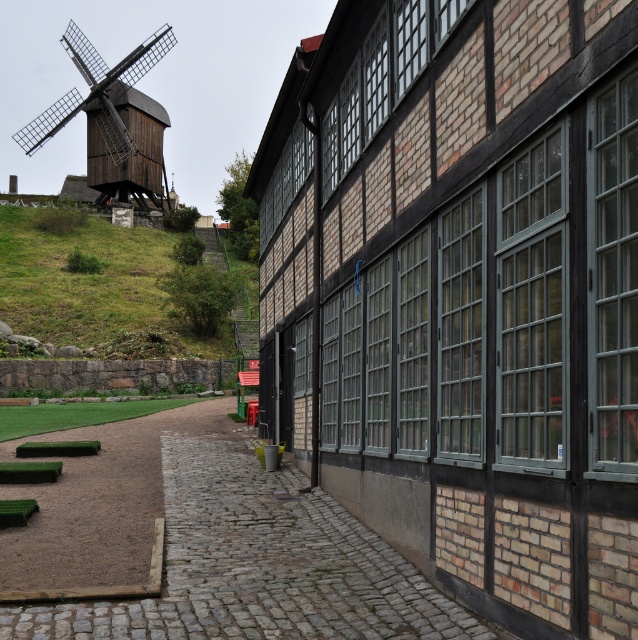
Does point (329, 541) lie behind point (15, 220)?

No.

Does cobblestone path at lower left have a lesser width compared to green grass at lower left?

Yes, cobblestone path at lower left is thinner than green grass at lower left.

This screenshot has height=640, width=638. What do you see at coordinates (216, 548) in the screenshot? I see `cobblestone path at lower left` at bounding box center [216, 548].

The image size is (638, 640). Find the location of `cobblestone path at lower left`. cobblestone path at lower left is located at coordinates (216, 548).

Is cobblestone path at lower left bigger than wooden windmill at left?

No, cobblestone path at lower left is not bigger than wooden windmill at left.

Is cobblestone path at lower left shorter than wooden windmill at left?

Yes, cobblestone path at lower left is shorter than wooden windmill at left.

Who is more forward, [114,602] or [31,140]?

Point [114,602]

Image resolution: width=638 pixels, height=640 pixels. In order to click on cobblestone path at lower left in this screenshot , I will do `click(216, 548)`.

Does green grass at lower left have a smaller size compared to wooden windmill at left?

Correct, green grass at lower left occupies less space than wooden windmill at left.

Is green grass at lower left further to the viewer compared to wooden windmill at left?

No, green grass at lower left is closer to the viewer.

The width and height of the screenshot is (638, 640). Find the location of `green grass at lower left`. green grass at lower left is located at coordinates (94, 289).

Identify the location of green grass at lower left. This screenshot has height=640, width=638. (94, 289).